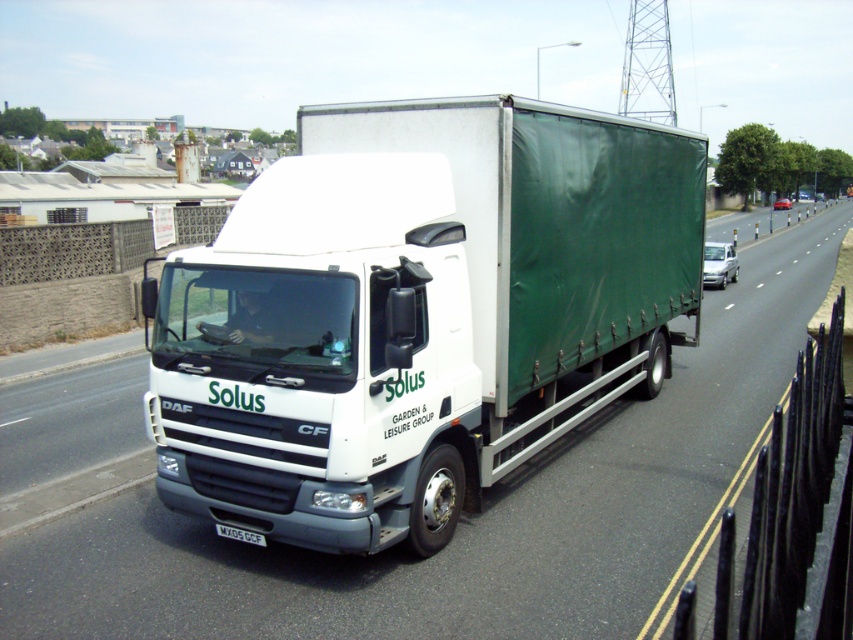
You are a traffic officer observing a white matte truck at center and a white truck at center on a multi lane road. Which truck is closer to you?

Both the white matte truck at center and the white truck at center are the same truck, so they are at the same distance from you.

You are a traffic officer observing a white matte truck at center with a white plastic license plate at center. Which object is bigger in size?

The white matte truck at center is bigger in size compared to the white plastic license plate at center.